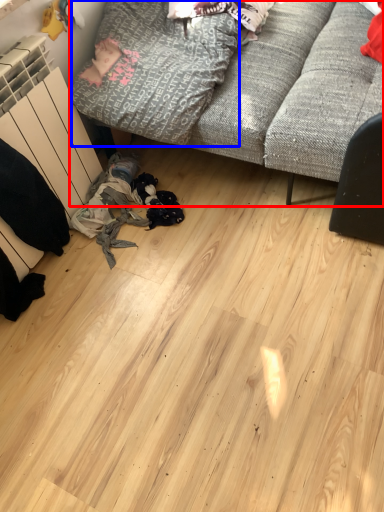
Question: Among these objects, which one is farthest to the camera, studio couch (highlighted by a red box) or clothing (highlighted by a blue box)?

Choices:
 (A) studio couch
 (B) clothing

Answer: (B)